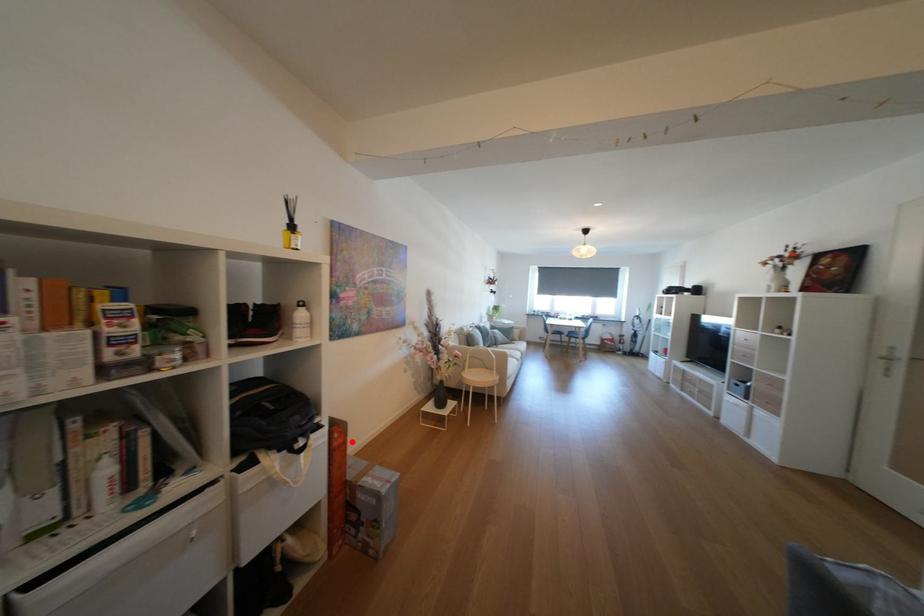
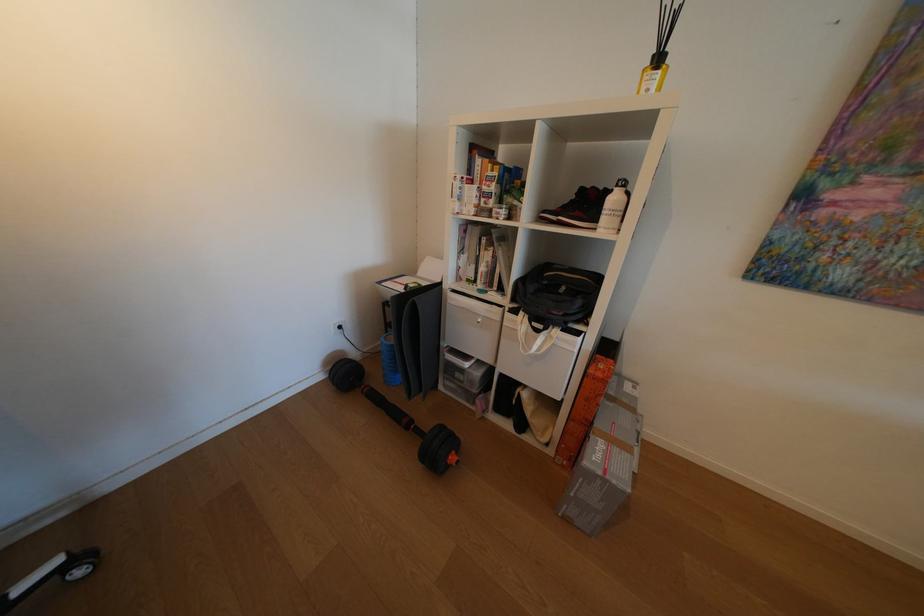
In the second image, find the point that corresponds to the highlighted location in the first image.

(611, 376)